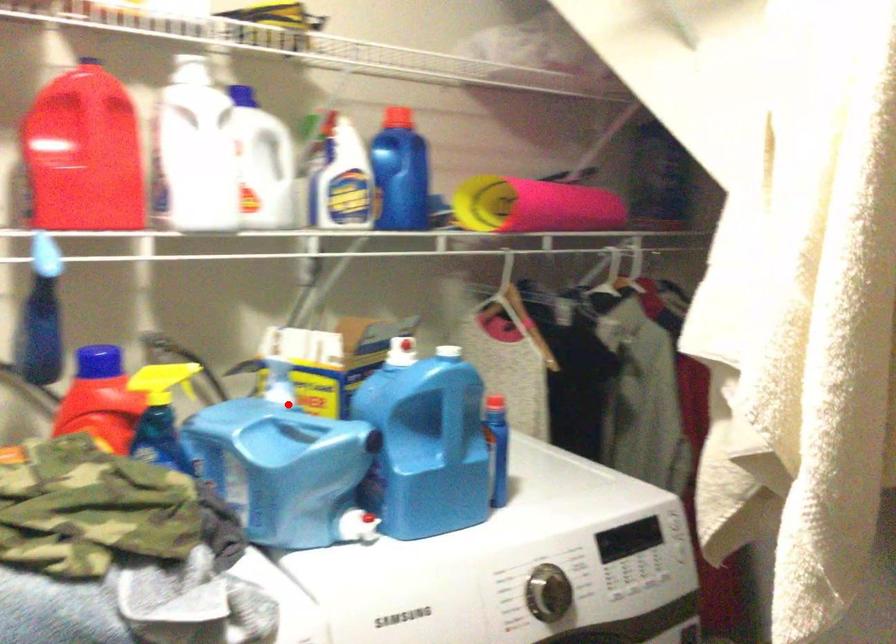
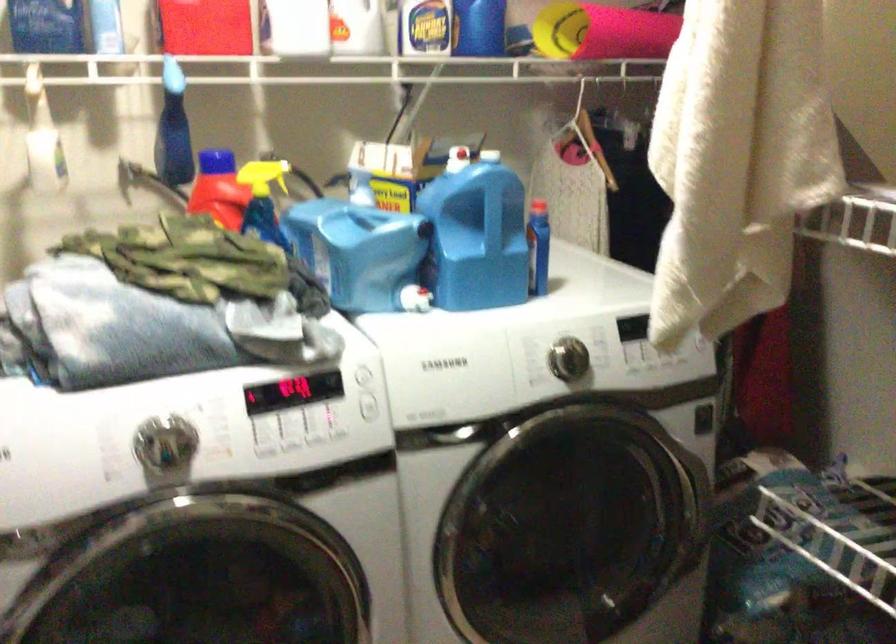
Question: I am providing you with two images of the same scene from different viewpoints. A red point is shown in image1. For the corresponding object point in image2, is it positioned nearer or farther from the camera?

Choices:
 (A) Nearer
 (B) Farther

Answer: (B)